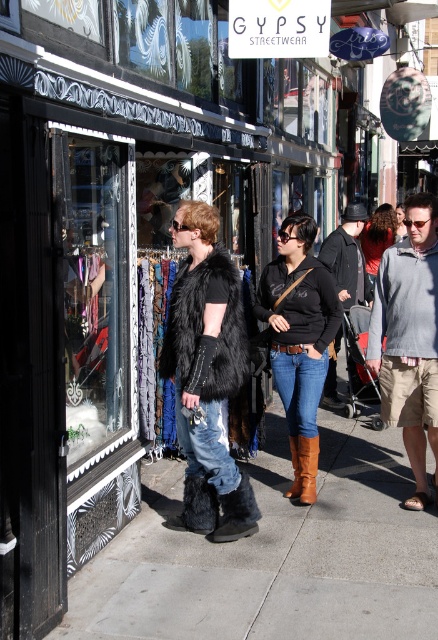
Question: Does jeans at center come in front of black suede boot at lower center?

Choices:
 (A) yes
 (B) no

Answer: (B)

Question: Which of the following is the closest to the observer?

Choices:
 (A) (221, 518)
 (B) (311, 460)
 (C) (293, 392)

Answer: (A)

Question: Is clear glass display at center bigger than matte black boots at center?

Choices:
 (A) no
 (B) yes

Answer: (A)

Question: Which point is farther to the camera?

Choices:
 (A) (388, 310)
 (B) (286, 608)

Answer: (A)

Question: Is clear glass display at center wider than brown leather boot at center?

Choices:
 (A) yes
 (B) no

Answer: (A)

Question: Which object appears farthest from the camera in this image?

Choices:
 (A) brown leather boots at lower center
 (B) brown leather boot at lower center

Answer: (B)